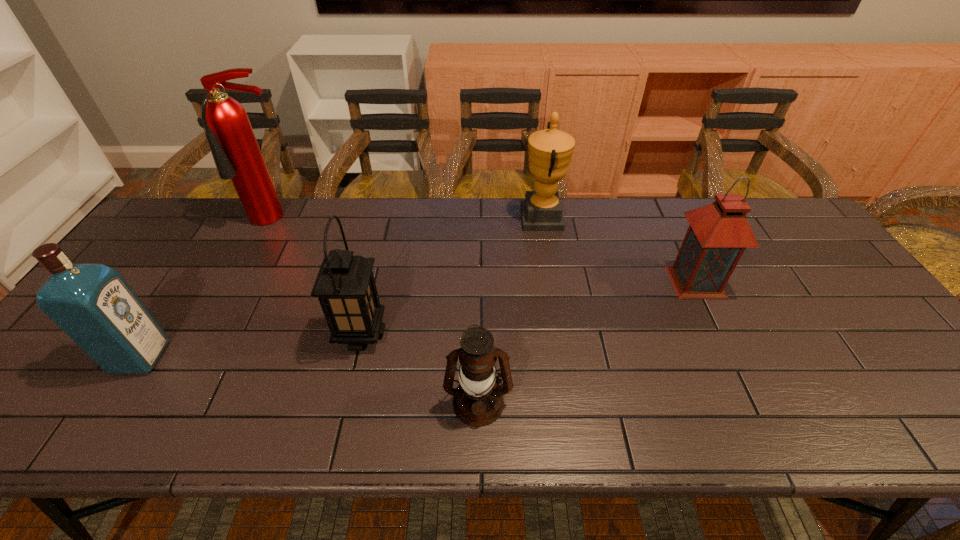
Find the location of a particular element. Image resolution: width=960 pixels, height=540 pixels. object present at the left edge is located at coordinates (92, 303).

Where is `free space at the far edge of the desktop`? The width and height of the screenshot is (960, 540). free space at the far edge of the desktop is located at coordinates (456, 225).

In the image, there is a desktop. What are the coordinates of `vacant region at the left edge` in the screenshot? It's located at (175, 245).

You are a GUI agent. You are given a task and a screenshot of the screen. Output one action in this format:
    pyautogui.click(x=<x>, y=<y>)
    Task: Click on the free location at the right edge of the desktop
    
    Given the screenshot: What is the action you would take?
    pyautogui.click(x=775, y=255)

In order to click on vacant space at the near right corner of the desktop in this screenshot , I will do `click(913, 421)`.

Find the location of a particular element. Image resolution: width=960 pixels, height=540 pixels. free space between the third object from right to left and the fourth object from right to left is located at coordinates (420, 368).

This screenshot has height=540, width=960. I want to click on empty location between the rightmost lantern and the second object from right to left, so click(x=619, y=249).

You are a GUI agent. You are given a task and a screenshot of the screen. Output one action in this format:
    pyautogui.click(x=<x>, y=<y>)
    Task: Click on the empty space between the fourth nearest object and the tallest object
    The image size is (960, 540).
    Given the screenshot: What is the action you would take?
    pyautogui.click(x=485, y=251)

Where is `free space between the rightmost lantern and the leftmost object`? This screenshot has height=540, width=960. free space between the rightmost lantern and the leftmost object is located at coordinates (419, 319).

Identify the location of free spot between the fifth object from left to right and the leftmost lantern. The height and width of the screenshot is (540, 960). (451, 276).